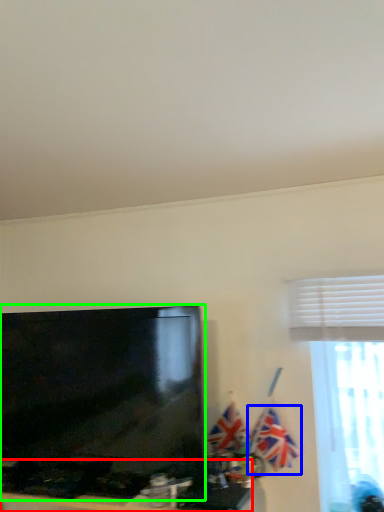
Question: Considering the real-world distances, which object is closest to furniture (highlighted by a red box)? flag (highlighted by a blue box) or television (highlighted by a green box).

Choices:
 (A) flag
 (B) television

Answer: (B)